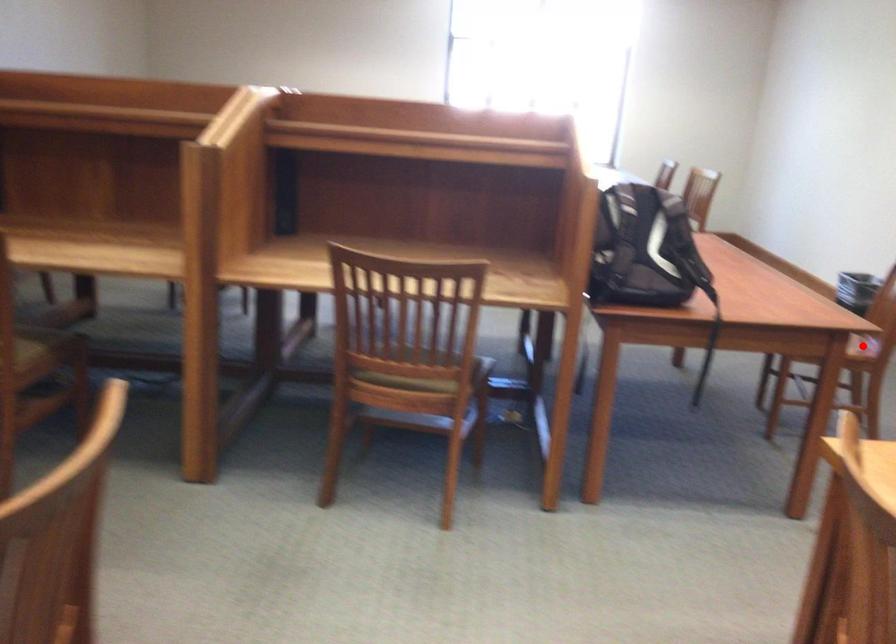
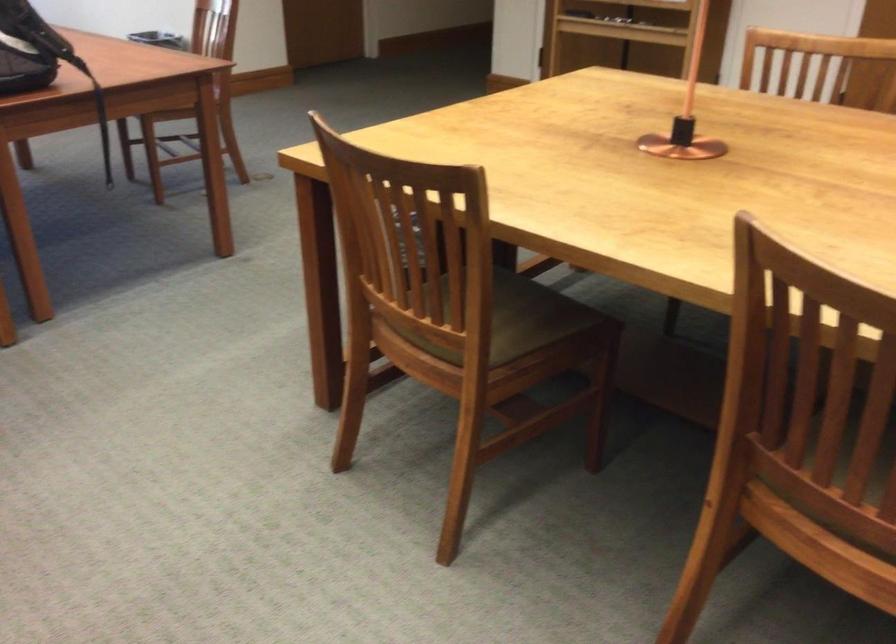
Question: I am providing you with two images of the same scene from different viewpoints. A red point is marked on the first image. Can you still see the location of the red point in image 2?

Choices:
 (A) Yes
 (B) No

Answer: (B)